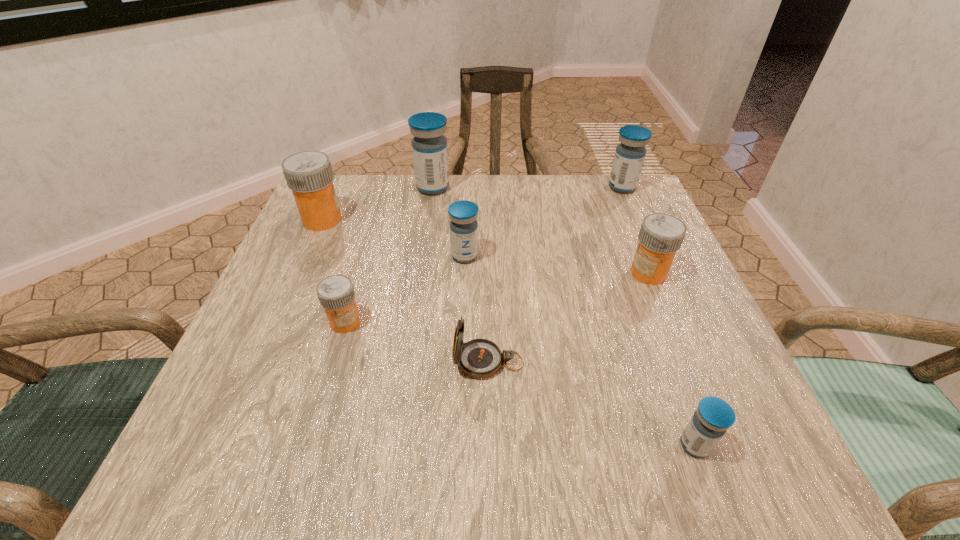
The height and width of the screenshot is (540, 960). In order to click on free region at the far edge in this screenshot , I will do `click(549, 185)`.

In order to click on vacant space at the near edge of the desktop in this screenshot , I will do `click(354, 460)`.

Where is `vacant region at the left edge of the desktop`? This screenshot has width=960, height=540. vacant region at the left edge of the desktop is located at coordinates (306, 297).

Identify the location of free space at the right edge. (684, 316).

Find the location of `free space at the far right corner of the desktop`. free space at the far right corner of the desktop is located at coordinates (632, 211).

Find the location of a particular element. vacant space that's between the farthest orange medicine and the leftmost blue medicine is located at coordinates (377, 204).

Identify the location of vacant space that is in between the compass and the nearest object. The width and height of the screenshot is (960, 540). (591, 403).

Identify the location of empty space that is in between the farthest orange medicine and the third nearest object. (334, 271).

What are the coordinates of `empty space between the third nearest object and the leftmost orange medicine` in the screenshot? It's located at (334, 271).

Where is `free area in between the third smallest blue medicine and the second nearest orange medicine`? The width and height of the screenshot is (960, 540). free area in between the third smallest blue medicine and the second nearest orange medicine is located at coordinates (636, 230).